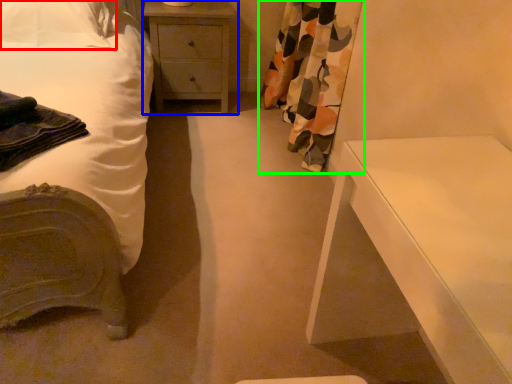
Question: Estimate the real-world distances between objects in this image. Which object is closer to pillow (highlighted by a red box), chest of drawers (highlighted by a blue box) or curtain (highlighted by a green box)?

Choices:
 (A) chest of drawers
 (B) curtain

Answer: (A)